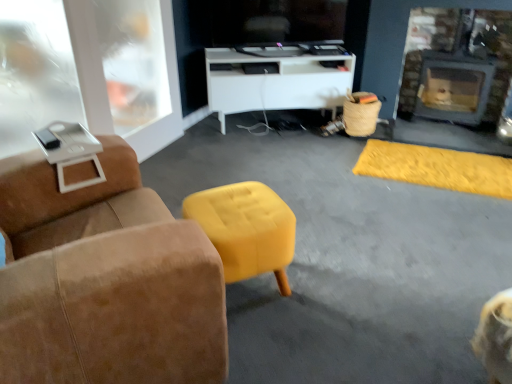
Question: Is suede armchair at left not within white glossy cabinet at center?

Choices:
 (A) yes
 (B) no

Answer: (A)

Question: Considering the relative positions of suede armchair at left and white glossy cabinet at center in the image provided, is suede armchair at left to the right of white glossy cabinet at center from the viewer's perspective?

Choices:
 (A) no
 (B) yes

Answer: (A)

Question: Is suede armchair at left oriented towards white glossy cabinet at center?

Choices:
 (A) no
 (B) yes

Answer: (A)

Question: Is white glossy cabinet at center at the back of suede armchair at left?

Choices:
 (A) yes
 (B) no

Answer: (B)

Question: Is suede armchair at left at the left side of white glossy cabinet at center?

Choices:
 (A) yes
 (B) no

Answer: (A)

Question: Can you confirm if suede armchair at left is shorter than white glossy cabinet at center?

Choices:
 (A) yes
 (B) no

Answer: (B)

Question: From a real-world perspective, is suede armchair at left below transparent plastic glass door at upper left?

Choices:
 (A) no
 (B) yes

Answer: (B)

Question: From the image's perspective, is suede armchair at left beneath transparent plastic glass door at upper left?

Choices:
 (A) yes
 (B) no

Answer: (A)

Question: Is suede armchair at left not inside transparent plastic glass door at upper left?

Choices:
 (A) no
 (B) yes

Answer: (B)

Question: Considering the relative sizes of suede armchair at left and transparent plastic glass door at upper left in the image provided, is suede armchair at left thinner than transparent plastic glass door at upper left?

Choices:
 (A) yes
 (B) no

Answer: (B)

Question: Can you see suede armchair at left touching transparent plastic glass door at upper left?

Choices:
 (A) no
 (B) yes

Answer: (A)

Question: Can you confirm if suede armchair at left is positioned to the right of transparent plastic glass door at upper left?

Choices:
 (A) yes
 (B) no

Answer: (A)

Question: Can you confirm if brick fireplace at right is thinner than white glossy cabinet at center?

Choices:
 (A) no
 (B) yes

Answer: (B)